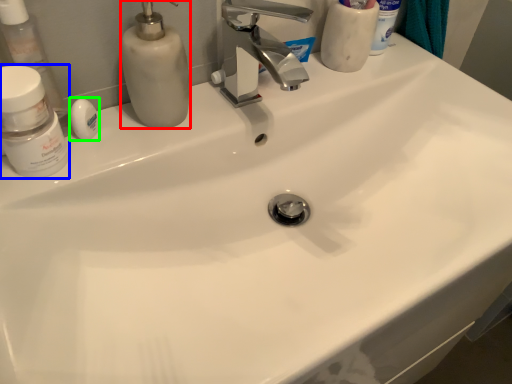
Question: Estimate the real-world distances between objects in this image. Which object is farther from soap dispenser (highlighted by a red box), mouthwash (highlighted by a blue box) or soap (highlighted by a green box)?

Choices:
 (A) mouthwash
 (B) soap

Answer: (A)